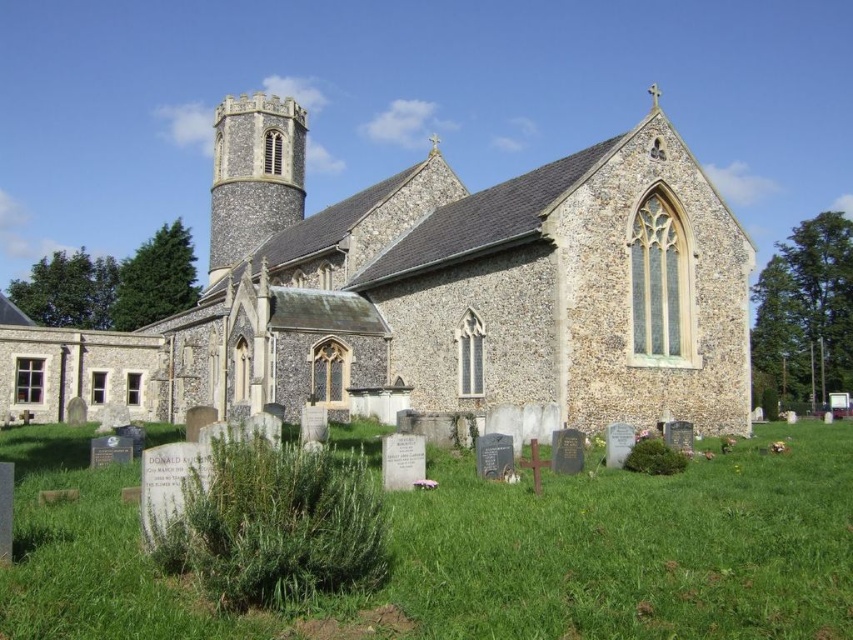
Question: Does brown stone church at center appear on the right side of green grass at lower center?

Choices:
 (A) no
 (B) yes

Answer: (B)

Question: Which point is farther to the camera?

Choices:
 (A) (618, 481)
 (B) (445, 330)

Answer: (B)

Question: Does brown stone church at center appear over green grass at lower center?

Choices:
 (A) no
 (B) yes

Answer: (B)

Question: Is the position of brown stone church at center less distant than that of green grass at lower center?

Choices:
 (A) yes
 (B) no

Answer: (B)

Question: Which of the following is the closest to the observer?

Choices:
 (A) brown stone church at center
 (B) green grass at lower center

Answer: (B)